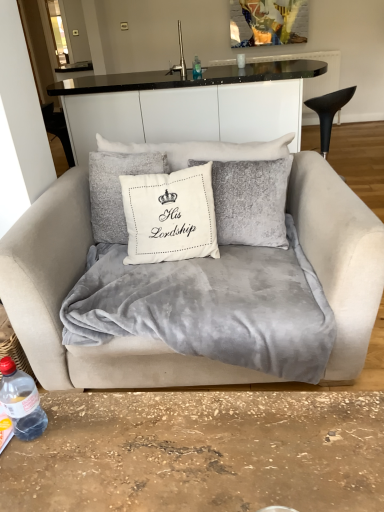
Question: Is velvet beige couch at center further to camera compared to silver metallic faucet at upper center?

Choices:
 (A) no
 (B) yes

Answer: (A)

Question: Is velvet beige couch at center placed right next to silver metallic faucet at upper center?

Choices:
 (A) no
 (B) yes

Answer: (A)

Question: Can you confirm if velvet beige couch at center is wider than silver metallic faucet at upper center?

Choices:
 (A) no
 (B) yes

Answer: (B)

Question: Is velvet beige couch at center smaller than silver metallic faucet at upper center?

Choices:
 (A) no
 (B) yes

Answer: (A)

Question: Considering the relative sizes of velvet beige couch at center and silver metallic faucet at upper center in the image provided, is velvet beige couch at center taller than silver metallic faucet at upper center?

Choices:
 (A) no
 (B) yes

Answer: (B)

Question: Is velvet beige couch at center not inside silver metallic faucet at upper center?

Choices:
 (A) no
 (B) yes

Answer: (B)

Question: From the image's perspective, is silver metallic faucet at upper center on white ceramic cup at upper center?

Choices:
 (A) no
 (B) yes

Answer: (B)

Question: Does silver metallic faucet at upper center have a smaller size compared to white ceramic cup at upper center?

Choices:
 (A) yes
 (B) no

Answer: (B)

Question: Can you confirm if silver metallic faucet at upper center is thinner than white ceramic cup at upper center?

Choices:
 (A) no
 (B) yes

Answer: (A)

Question: Does silver metallic faucet at upper center have a larger size compared to white ceramic cup at upper center?

Choices:
 (A) yes
 (B) no

Answer: (A)

Question: Considering the relative sizes of silver metallic faucet at upper center and white ceramic cup at upper center in the image provided, is silver metallic faucet at upper center taller than white ceramic cup at upper center?

Choices:
 (A) yes
 (B) no

Answer: (A)

Question: From a real-world perspective, is silver metallic faucet at upper center located higher than white ceramic cup at upper center?

Choices:
 (A) yes
 (B) no

Answer: (A)

Question: Can you confirm if transparent plastic bottle at center, marked as the second bottle in a left-to-right arrangement, is thinner than white ceramic cup at upper center?

Choices:
 (A) no
 (B) yes

Answer: (B)